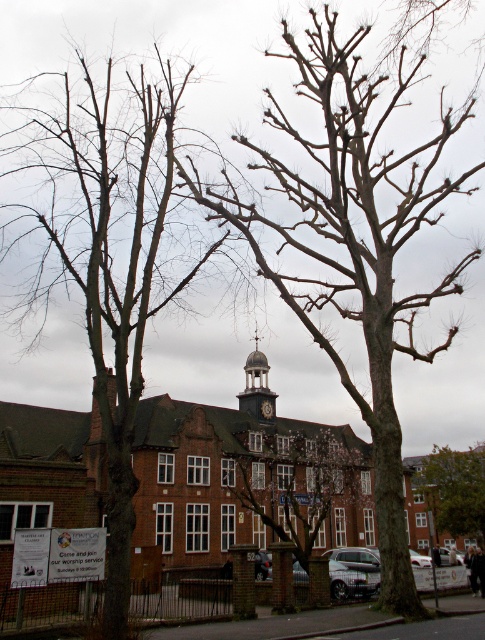
Question: Which of the following is the closest to the observer?

Choices:
 (A) (227, 486)
 (B) (270, 413)
 (C) (29, 131)

Answer: (A)

Question: Where is brown textured tree at center located in relation to dark brown wooden clock at center in the image?

Choices:
 (A) left
 (B) right

Answer: (B)

Question: Which object is the closest to the dark gray stone clock tower at center?

Choices:
 (A) green leafy tree at center
 (B) bare wood tree at center
 (C) dark brown wooden clock at center
 (D) smooth bark tree at left

Answer: (C)

Question: Is brown textured tree at center to the right of dark gray stone clock tower at center from the viewer's perspective?

Choices:
 (A) no
 (B) yes

Answer: (B)

Question: Which object is farther from the camera taking this photo?

Choices:
 (A) dark brown wooden clock at center
 (B) green leafy tree at center
 (C) smooth bark tree at left
 (D) dark gray stone clock tower at center

Answer: (B)

Question: Does bare wood tree at center have a smaller size compared to brown textured tree at center?

Choices:
 (A) yes
 (B) no

Answer: (B)